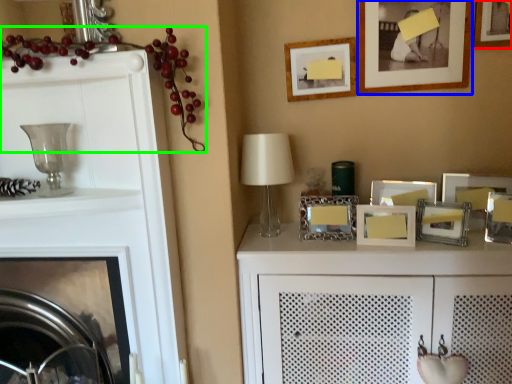
Question: Which object is the farthest from picture frame (highlighted by a red box)? Choose among these: picture frame (highlighted by a blue box) or fruit (highlighted by a green box).

Choices:
 (A) picture frame
 (B) fruit

Answer: (B)